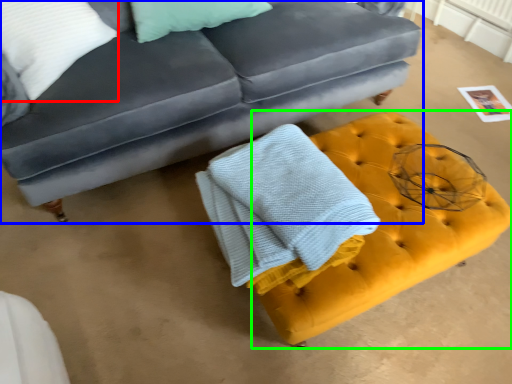
Question: Which is farther away from pillow (highlighted by a red box)? studio couch (highlighted by a blue box) or footrest (highlighted by a green box)?

Choices:
 (A) studio couch
 (B) footrest

Answer: (B)